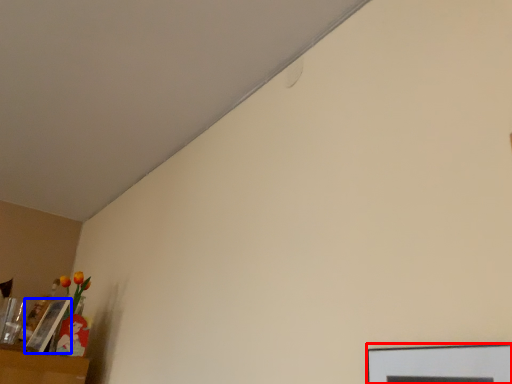
Question: Which of the following is the farthest to the observer, picture frame (highlighted by a red box) or picture frame (highlighted by a blue box)?

Choices:
 (A) picture frame
 (B) picture frame

Answer: (B)